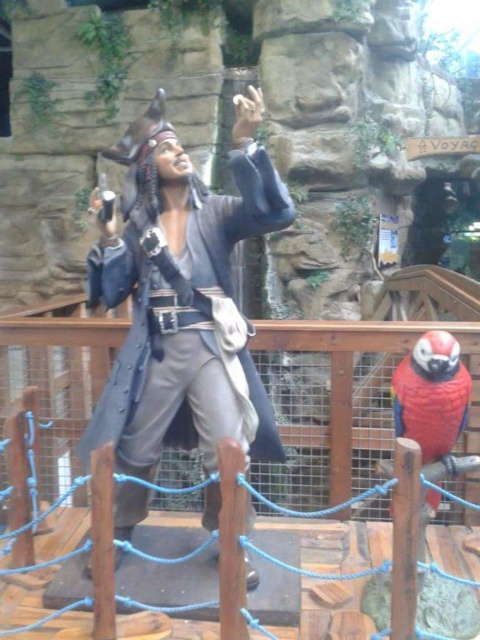
Between matte black pirate at center and shiny red parrot at lower right, which one appears on the left side from the viewer's perspective?

matte black pirate at center

Identify the location of matte black pirate at center. (182, 298).

Which is behind, point (206, 292) or point (411, 406)?

Positioned behind is point (206, 292).

Image resolution: width=480 pixels, height=640 pixels. Find the location of `matte black pirate at center`. matte black pirate at center is located at coordinates (182, 298).